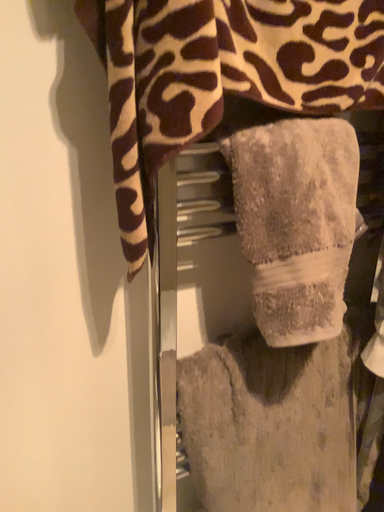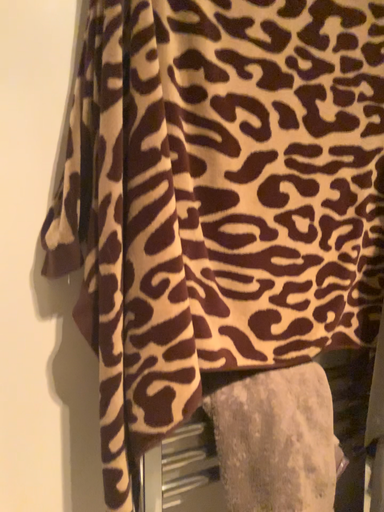
Question: How did the camera likely rotate when shooting the video?

Choices:
 (A) rotated upward
 (B) rotated downward

Answer: (A)